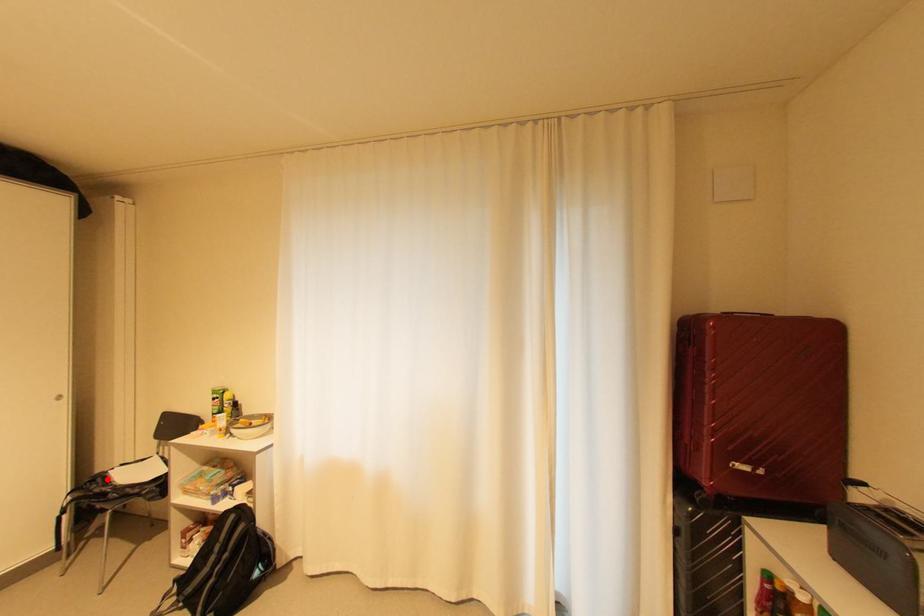
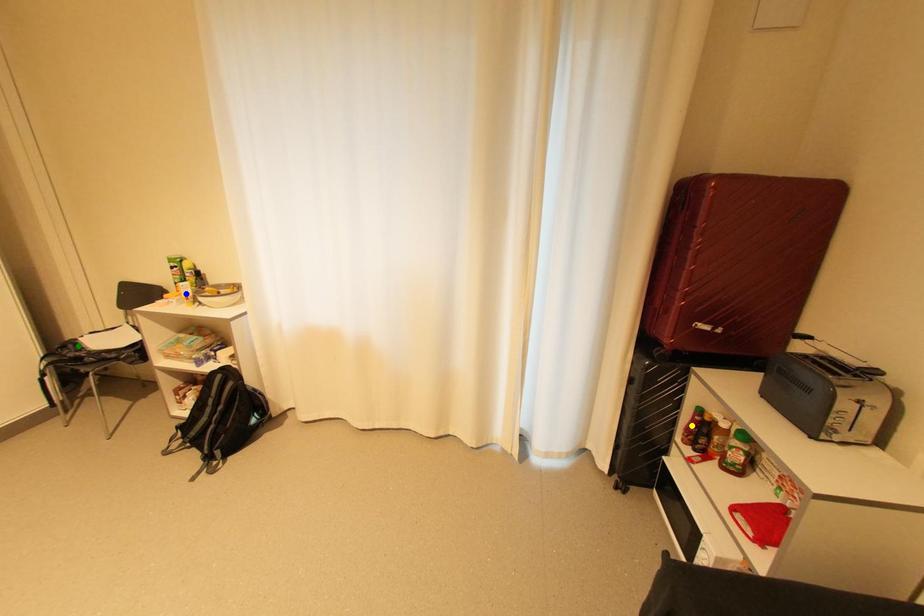
Question: I am providing you with two images of the same scene from different viewpoints. A red point is marked on the first image. You are given multiple points on the second image. Which mark in image 2 goes with the point in image 1?

Choices:
 (A) blue point
 (B) yellow point
 (C) green point

Answer: (C)